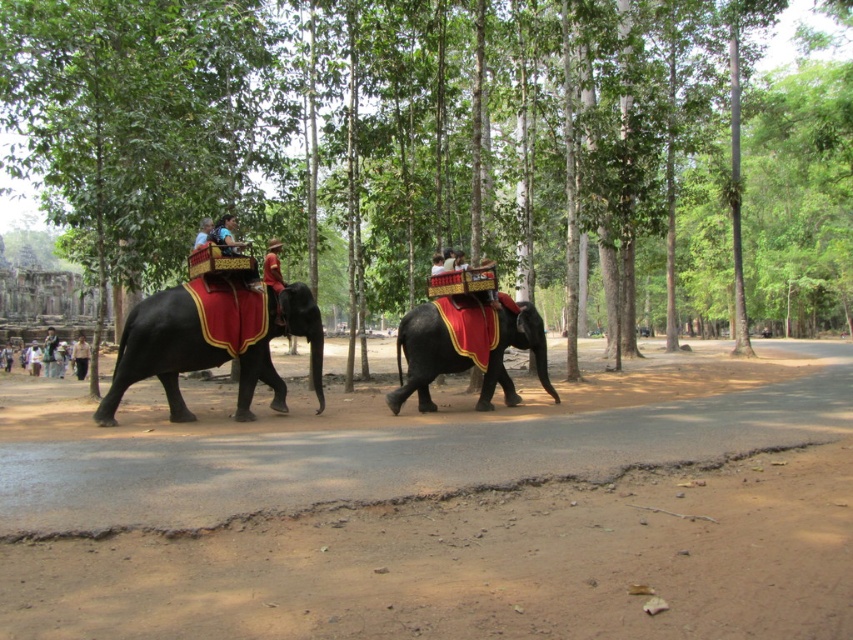
Question: Which of these objects is positioned closest to the shiny black elephant at center?

Choices:
 (A) dark brown leather hat at center
 (B) smooth brown skin at center
 (C) red velvet cloth at center

Answer: (C)

Question: Can you confirm if red velvet cloth at center is positioned below light beige cotton shirt at center?

Choices:
 (A) no
 (B) yes

Answer: (A)

Question: Which of these objects is positioned closest to the light beige cotton shirt at center?

Choices:
 (A) matte black elephant at center
 (B) smooth brown skin at center

Answer: (A)

Question: In this image, where is red velvet cloth at center located relative to smooth brown skin at center?

Choices:
 (A) right
 (B) left

Answer: (A)

Question: Is red velvet cloth at center further to camera compared to smooth brown skin at center?

Choices:
 (A) no
 (B) yes

Answer: (B)

Question: Which object is farther from the camera taking this photo?

Choices:
 (A) shiny black elephant at center
 (B) red velvet cloth at center

Answer: (A)